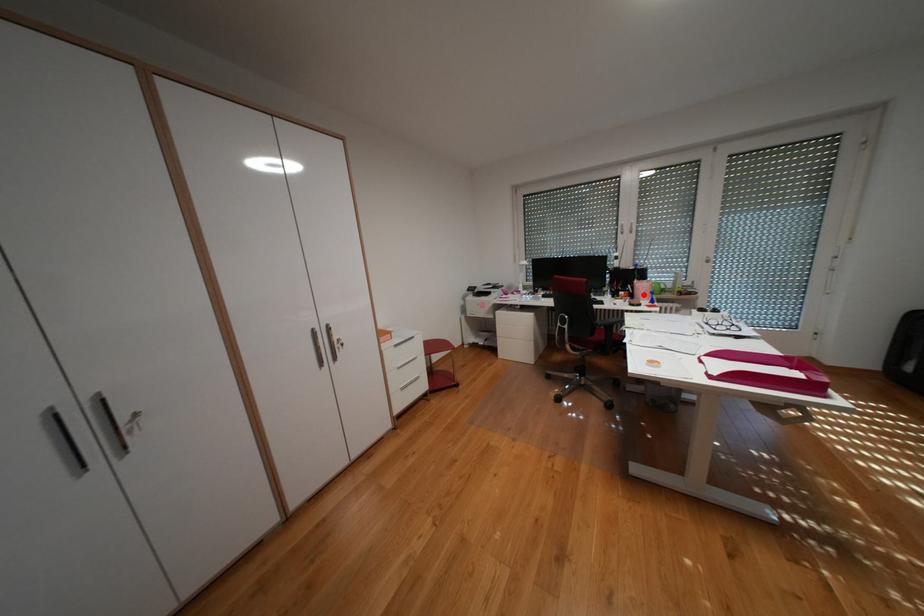
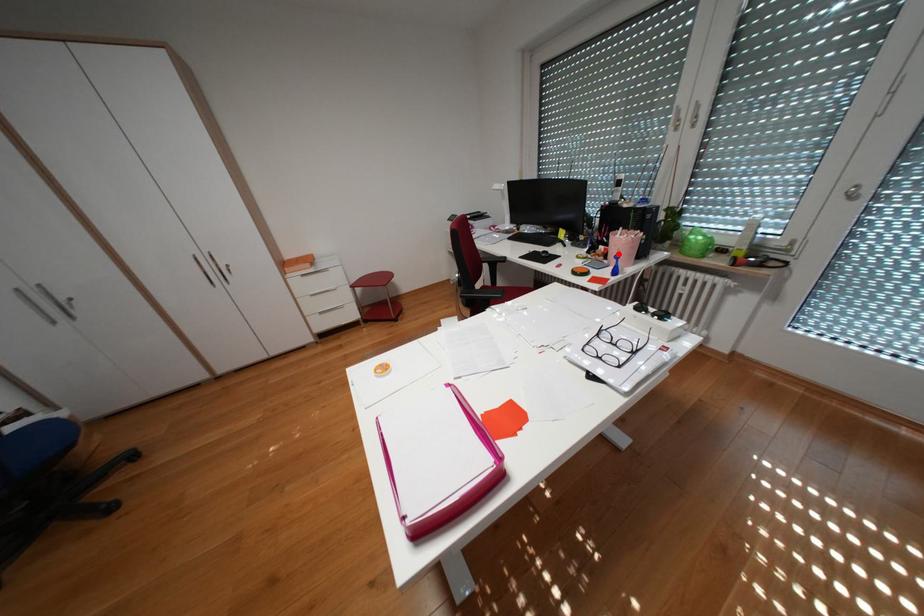
I am providing you with two images of the same scene from different viewpoints. A red point is marked on the first image and another point is marked on the second image. Are the points marked in image1 and image2 representing the same 3D position?

Yes